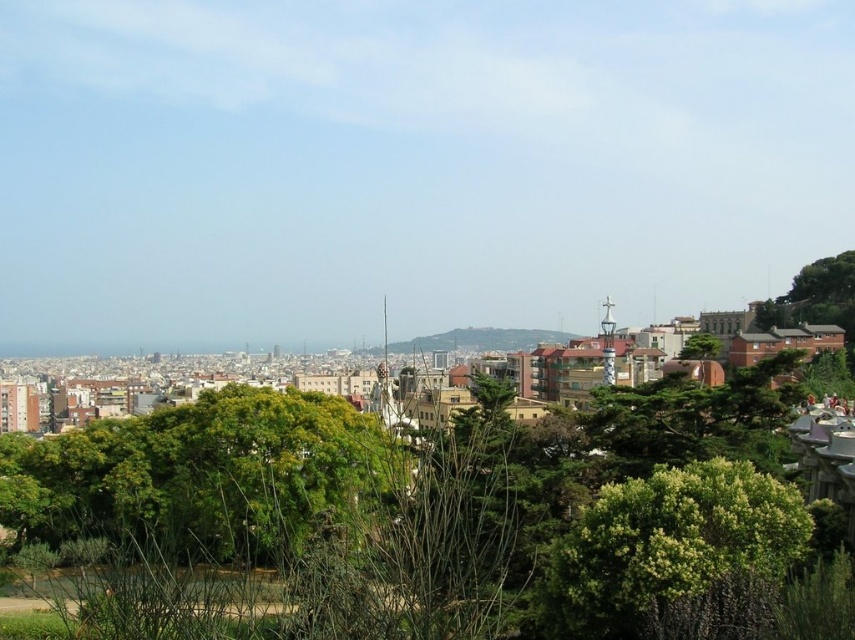
You are a drone operator trying to capture aerial shots of the city. You have two points of interest marked on your screen. The first point is at coordinates point [694,554] and the second is at point [528,344]. Which point is closer to your drone camera lens?

Point [694,554] is closer to the camera than point [528,344].

You are standing in a city park in Barcelona. There is a point at coordinates (546, 332) that you want to reach. If you can walk 100 meters per minute, how many minutes will it take you to reach that point?

The point at coordinates (546, 332) is 519.32 meters away from you. At a walking speed of 100 meters per minute, it would take approximately 5.19 minutes to reach the point.